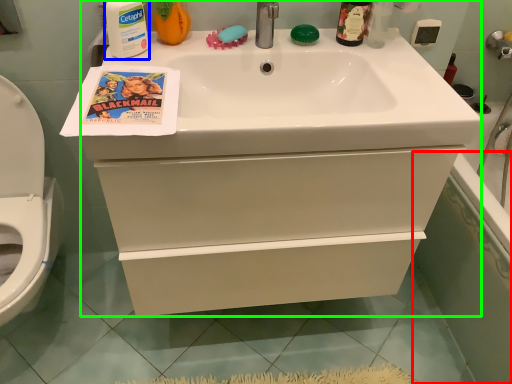
Question: Considering the real-world distances, which object is closest to bath (highlighted by a red box)? cleaning product (highlighted by a blue box) or bathroom cabinet (highlighted by a green box).

Choices:
 (A) cleaning product
 (B) bathroom cabinet

Answer: (B)